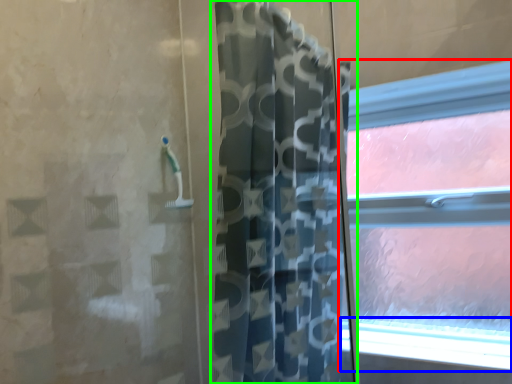
Question: Which object is the farthest from window (highlighted by a red box)? Choose among these: window sill (highlighted by a blue box) or curtain (highlighted by a green box).

Choices:
 (A) window sill
 (B) curtain

Answer: (B)